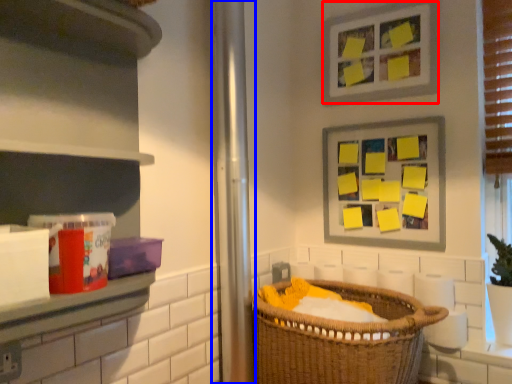
Question: Which object is further to the camera taking this photo, picture frame (highlighted by a red box) or screen door (highlighted by a blue box)?

Choices:
 (A) picture frame
 (B) screen door

Answer: (A)